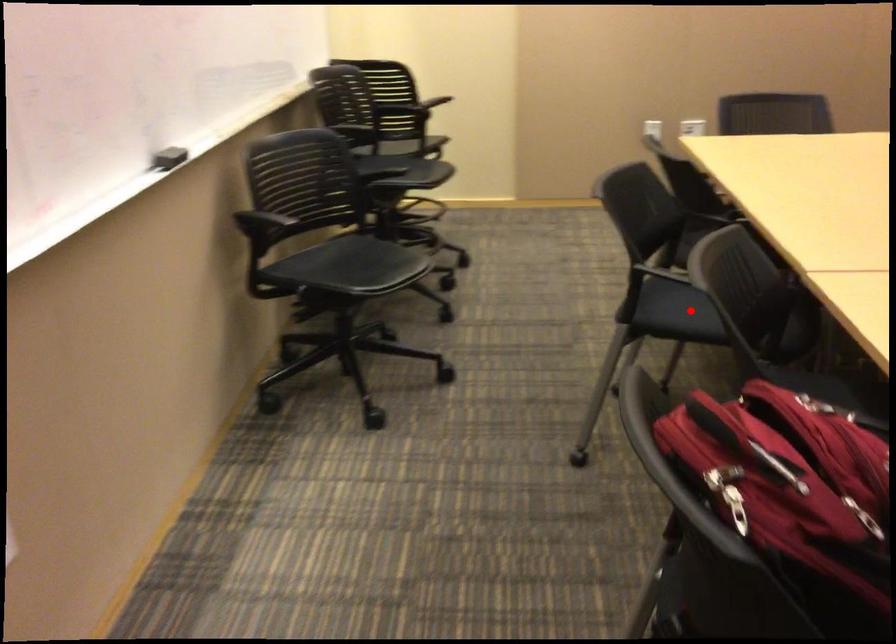
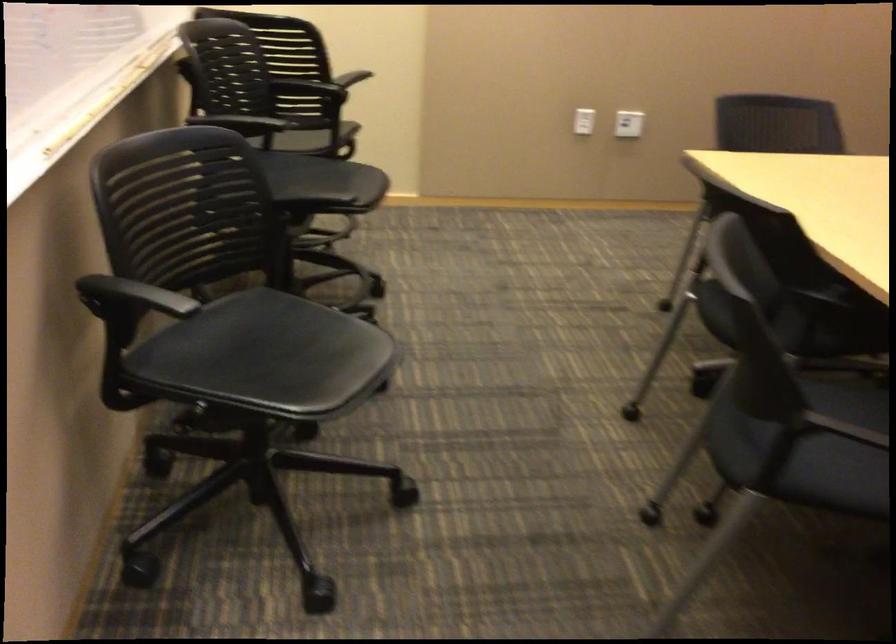
Question: I am providing you with two images of the same scene from different viewpoints. Given a red point in image1, look at the same physical point in image2. Is it:

Choices:
 (A) Closer to the viewpoint
 (B) Farther from the viewpoint

Answer: (A)